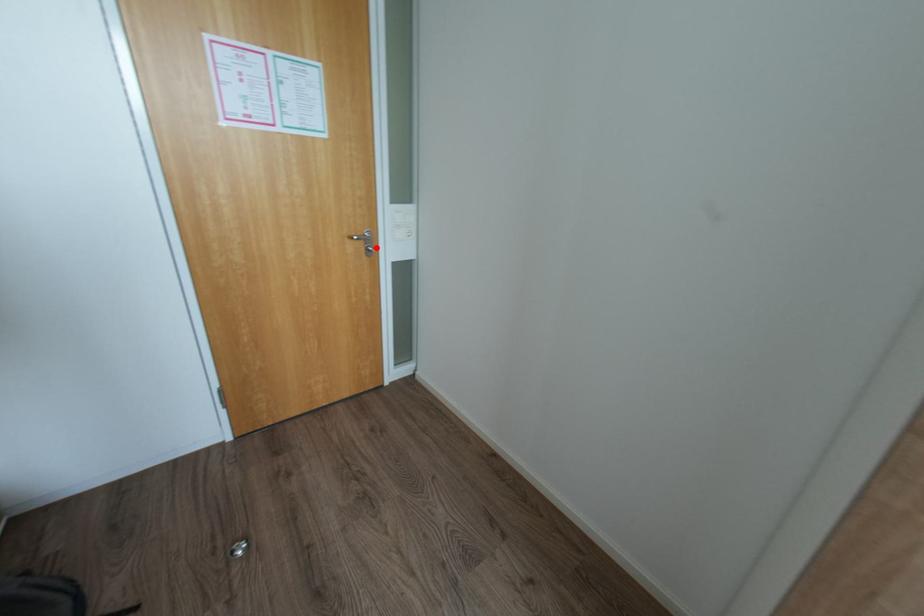
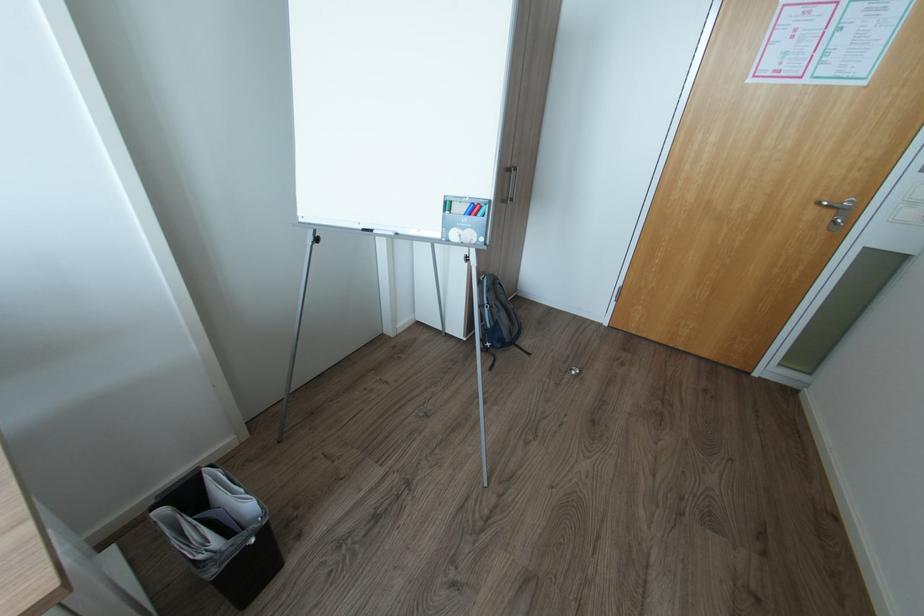
Question: I am providing you with two images of the same scene from different viewpoints. In image1, a red point is highlighted. Considering the same 3D point in image2, which of the following is correct?

Choices:
 (A) It is closer
 (B) It is farther

Answer: (B)